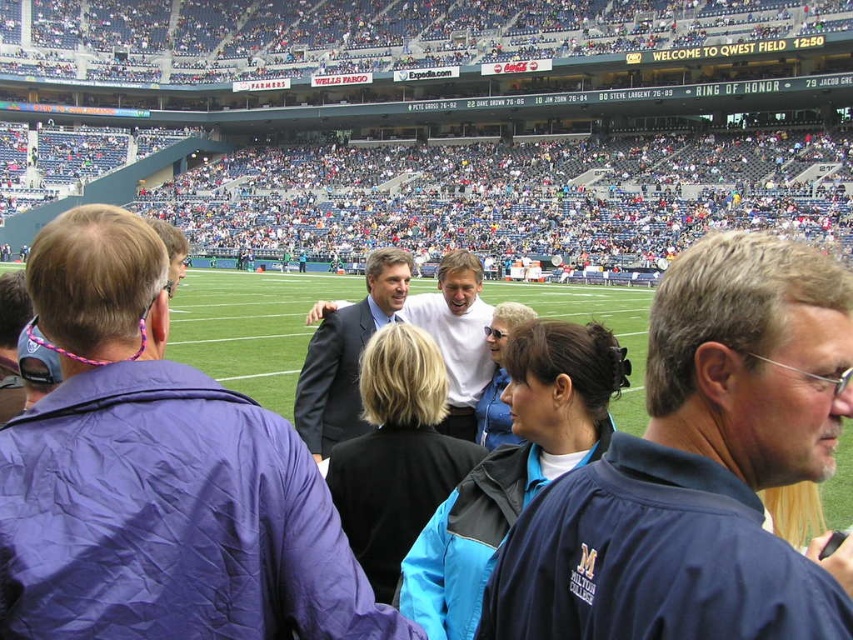
Question: Is the position of dark gray suit at center more distant than that of matte black suit at center?

Choices:
 (A) no
 (B) yes

Answer: (A)

Question: Which of the following is the closest to the observer?

Choices:
 (A) (587, 602)
 (B) (656, 186)
 (C) (38, 568)

Answer: (C)

Question: Does dark suit at center have a greater width compared to dark gray suit at center?

Choices:
 (A) no
 (B) yes

Answer: (B)

Question: Which of these objects is positioned farthest from the blue fabric jacket at center?

Choices:
 (A) dark gray suit at center
 (B) dark suit at center
 (C) blue stadium seats at upper center

Answer: (C)

Question: In this image, where is blue fabric jacket at center located relative to matte black suit at center?

Choices:
 (A) right
 (B) left

Answer: (A)

Question: Which point is closer to the camera?

Choices:
 (A) dark gray suit at center
 (B) blue fabric jacket at center
 (C) blue stadium seats at upper center

Answer: (B)